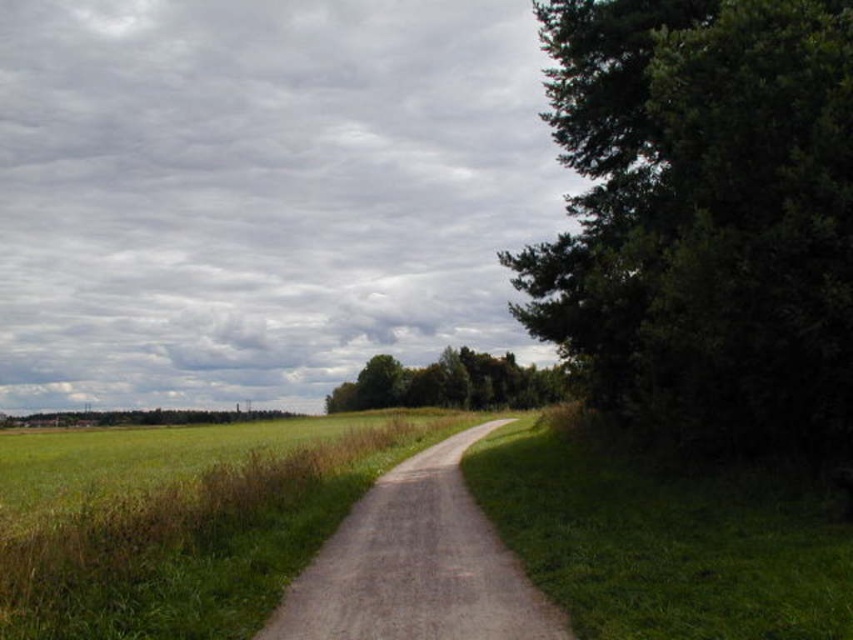
Question: Is dirt/gravel path at center to the right of green leafy trees at center from the viewer's perspective?

Choices:
 (A) yes
 (B) no

Answer: (B)

Question: Among these objects, which one is farthest from the camera?

Choices:
 (A) dirt/gravel path at center
 (B) green leafy trees at center
 (C) green leafy tree at right

Answer: (B)

Question: Is dirt/gravel path at center further to the viewer compared to green leafy trees at center?

Choices:
 (A) no
 (B) yes

Answer: (A)

Question: Which of the following is the farthest from the observer?

Choices:
 (A) green leafy tree at right
 (B) green leafy trees at center
 (C) dirt/gravel path at center

Answer: (B)

Question: Considering the relative positions of dirt/gravel path at center and green leafy trees at center in the image provided, where is dirt/gravel path at center located with respect to green leafy trees at center?

Choices:
 (A) left
 (B) right

Answer: (A)

Question: Which point is closer to the camera?

Choices:
 (A) [428, 400]
 (B) [496, 577]

Answer: (B)